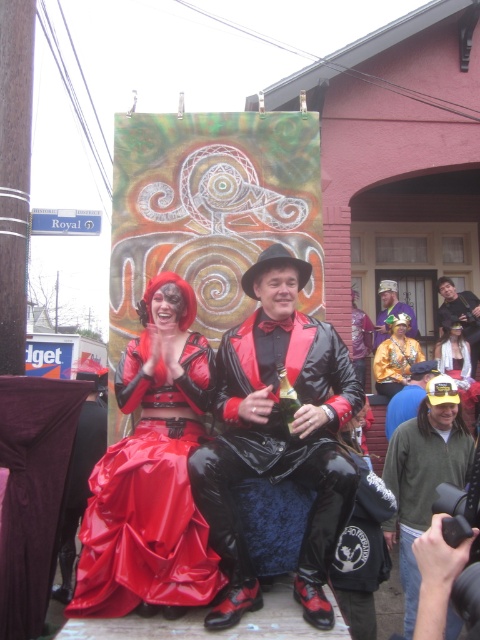
In the scene shown: Can you confirm if shiny red dress at center is smaller than yellowmaterialhat at right?

No.

Find the location of a particular element. This screenshot has width=480, height=640. shiny red dress at center is located at coordinates (152, 472).

Can you confirm if glossy vinyl dress at center is bigger than shiny red dress at center?

Yes.

Which of these two, glossy vinyl dress at center or shiny red dress at center, stands shorter?

shiny red dress at center

The image size is (480, 640). What are the coordinates of `glossy vinyl dress at center` in the screenshot? It's located at (276, 435).

What are the coordinates of `glossy vinyl dress at center` in the screenshot? It's located at (276, 435).

Which is more to the right, satin gold dress at center or matte black dress at center?

matte black dress at center

Which is more to the left, satin gold dress at center or matte black dress at center?

From the viewer's perspective, satin gold dress at center appears more on the left side.

Which is behind, point (402, 326) or point (468, 374)?

The point (402, 326) is behind.

I want to click on satin gold dress at center, so click(396, 356).